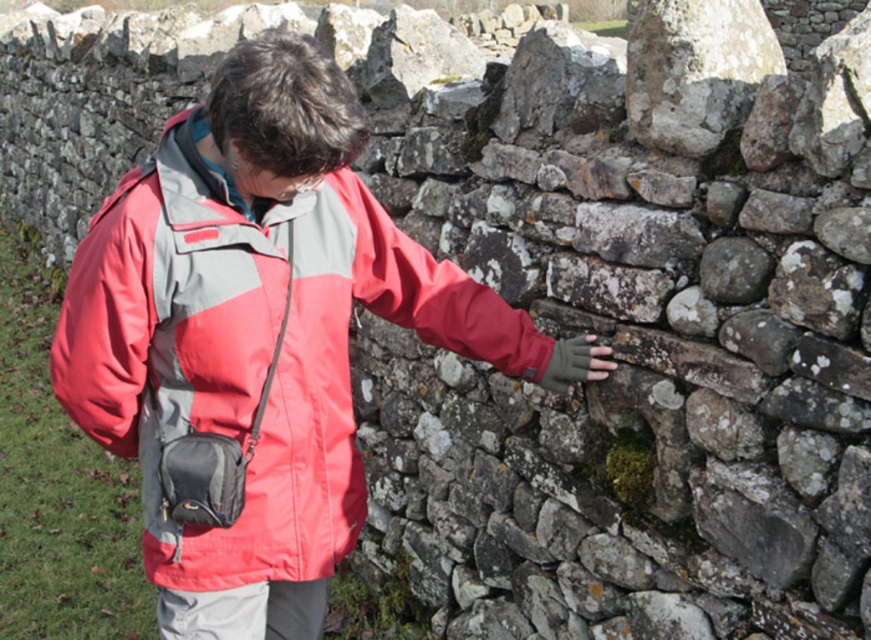
Question: Is the position of matte nylon jacket at center more distant than that of speckled stone at upper right?

Choices:
 (A) no
 (B) yes

Answer: (A)

Question: Is matte nylon jacket at center smaller than speckled stone at upper right?

Choices:
 (A) no
 (B) yes

Answer: (A)

Question: In this image, where is matte nylon jacket at center located relative to speckled stone at upper right?

Choices:
 (A) left
 (B) right

Answer: (A)

Question: Which point is closer to the camera?

Choices:
 (A) (663, 125)
 (B) (323, 218)

Answer: (B)

Question: Which of the following is the farthest from the observer?

Choices:
 (A) (338, 424)
 (B) (753, 36)

Answer: (B)